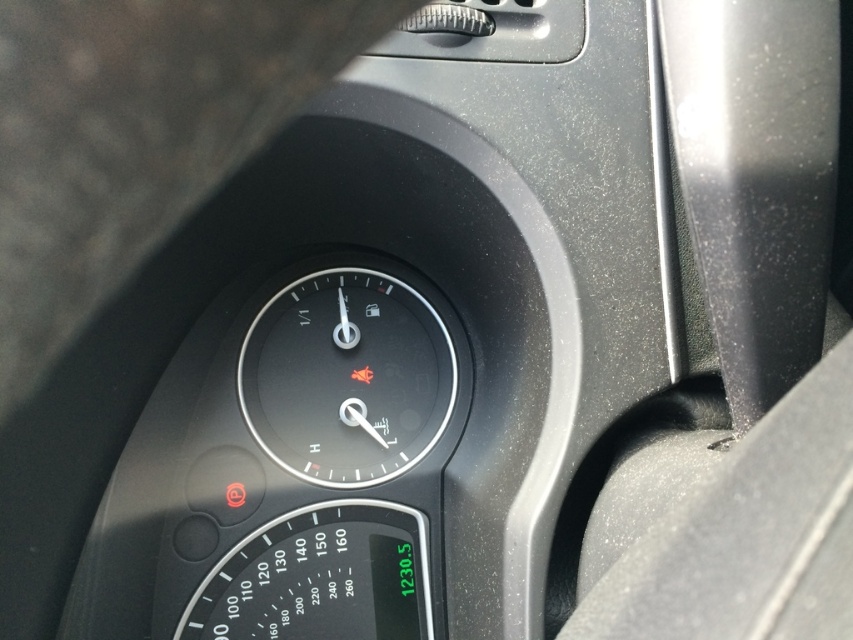
You are a driver checking your car dashboard. You see the black matte speedometer at center and the black plastic speedometer at lower center. Which one is positioned higher on the dashboard?

The black matte speedometer at center is positioned higher on the dashboard than the black plastic speedometer at lower center.

You are driving a car and need to check both the black matte speedometer at center and the black plastic speedometer at lower center. Which one is positioned to the right side of the other?

The black matte speedometer at center is to the right of the black plastic speedometer at lower center.

You are a mechanic inspecting a car dashboard. You need to replace a part that requires access to the black matte speedometer at center and the black plastic speedometer at lower center. Which one is narrower in width?

The black matte speedometer at center has a lesser width compared to the black plastic speedometer at lower center, so it is narrower.